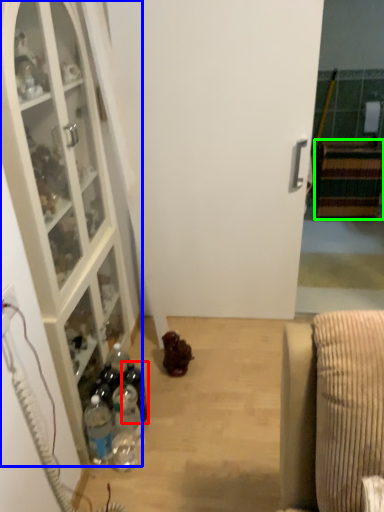
Question: Which is farther away from bottle (highlighted by a red box)? cabinetry (highlighted by a blue box) or cabinetry (highlighted by a green box)?

Choices:
 (A) cabinetry
 (B) cabinetry

Answer: (B)